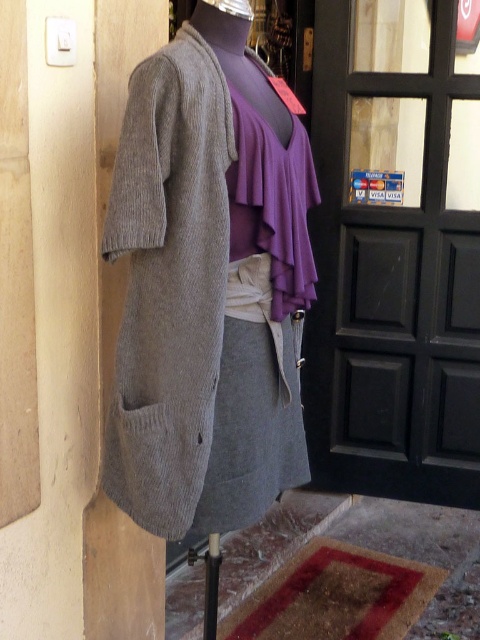
Is knitted gray jacket at center above black glass door at upper right?

Actually, knitted gray jacket at center is below black glass door at upper right.

Does knitted gray jacket at center have a greater width compared to black glass door at upper right?

No, knitted gray jacket at center is not wider than black glass door at upper right.

I want to click on knitted gray jacket at center, so click(x=207, y=285).